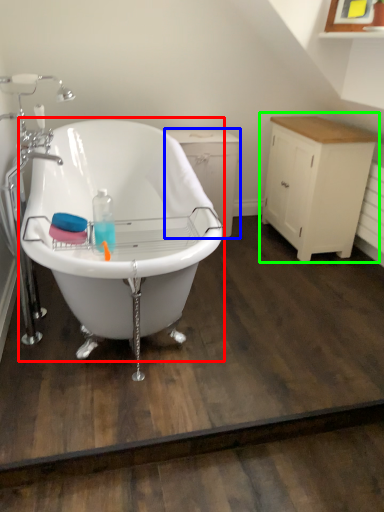
Question: Based on their relative distances, which object is farther from bathtub (highlighted by a red box)? Choose from dresser (highlighted by a blue box) and cabinetry (highlighted by a green box).

Choices:
 (A) dresser
 (B) cabinetry

Answer: (B)